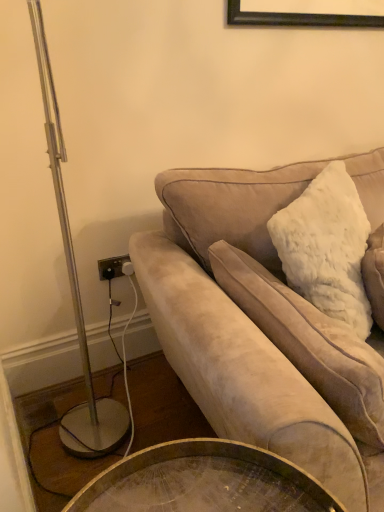
Question: Looking at their shapes, would you say white fluffy pillow at upper right is wider or thinner than suede couch at right?

Choices:
 (A) thin
 (B) wide

Answer: (A)

Question: In the image, is white fluffy pillow at upper right on the left side or the right side of suede couch at right?

Choices:
 (A) right
 (B) left

Answer: (B)

Question: Considering the positions of white fluffy pillow at upper right and suede couch at right in the image, is white fluffy pillow at upper right bigger or smaller than suede couch at right?

Choices:
 (A) big
 (B) small

Answer: (B)

Question: Considering the positions of suede couch at right and white fluffy pillow at upper right in the image, is suede couch at right taller or shorter than white fluffy pillow at upper right?

Choices:
 (A) tall
 (B) short

Answer: (A)

Question: From a real-world perspective, relative to white fluffy pillow at upper right, is suede couch at right vertically above or below?

Choices:
 (A) below
 (B) above

Answer: (A)

Question: Choose the correct answer: Is suede couch at right inside white fluffy pillow at upper right or outside it?

Choices:
 (A) outside
 (B) inside

Answer: (A)

Question: Is point (372, 506) closer or farther from the camera than point (223, 286)?

Choices:
 (A) closer
 (B) farther

Answer: (A)